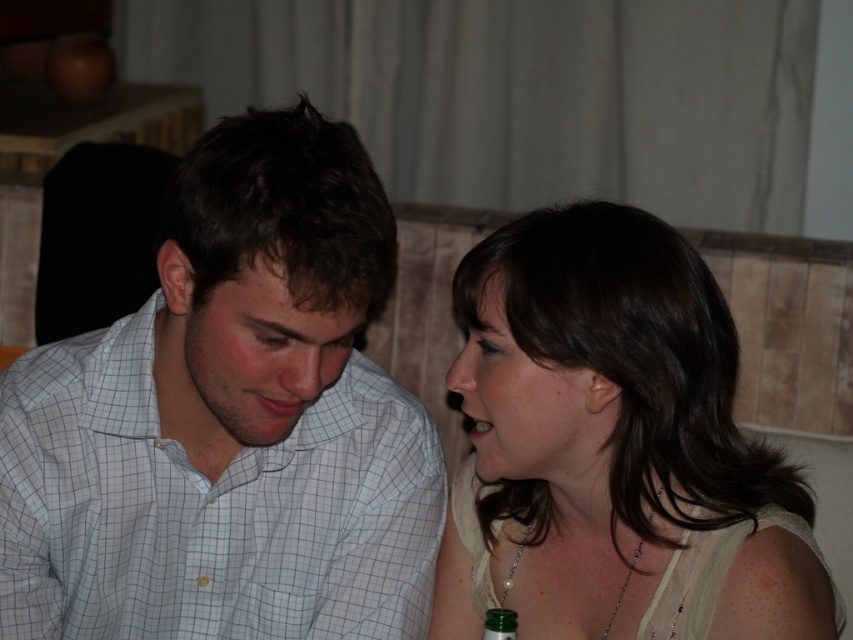
Question: Which of the following is the closest to the observer?

Choices:
 (A) coord(508,625)
 (B) coord(152,600)

Answer: (A)

Question: Is white checkered shirt at center positioned in front of green glass bottle at lower center?

Choices:
 (A) no
 (B) yes

Answer: (B)

Question: Can you confirm if white checkered shirt at center is bigger than green glass bottle at lower center?

Choices:
 (A) yes
 (B) no

Answer: (A)

Question: Among these points, which one is nearest to the camera?

Choices:
 (A) (160, 360)
 (B) (492, 611)

Answer: (B)

Question: Among these objects, which one is farthest from the camera?

Choices:
 (A) matte white blouse at center
 (B) white checkered shirt at center
 (C) green glass bottle at lower center

Answer: (C)

Question: Is matte white blouse at center smaller than green glass bottle at lower center?

Choices:
 (A) yes
 (B) no

Answer: (B)